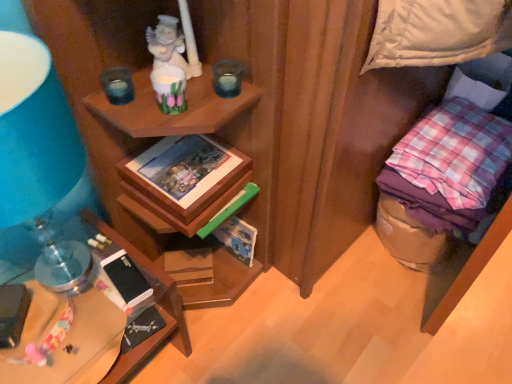
Locate an element on the screen. free spot above wooden picture frame at center (from a real-world perspective) is located at coordinates [181, 159].